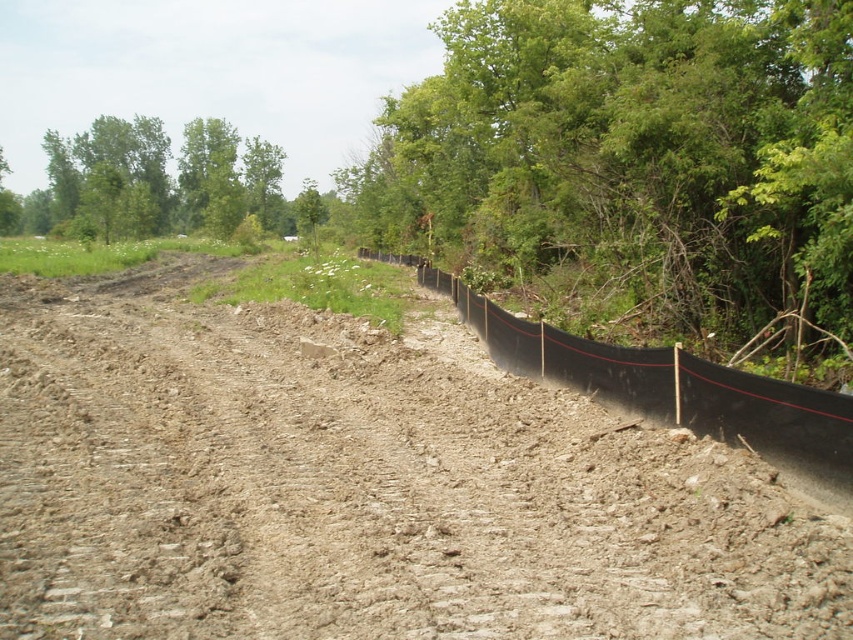
Question: Where is green leafy tree at right located in relation to green leafy tree at upper left in the image?

Choices:
 (A) left
 (B) right

Answer: (B)

Question: Does black plastic fence at right appear on the right side of green leafy tree at upper left?

Choices:
 (A) yes
 (B) no

Answer: (A)

Question: Among these points, which one is farthest from the camera?

Choices:
 (A) (817, 401)
 (B) (199, 205)

Answer: (B)

Question: Can you confirm if brown soil at center is bigger than green leafy tree at right?

Choices:
 (A) yes
 (B) no

Answer: (B)

Question: Which point appears closest to the camera in this image?

Choices:
 (A) (695, 92)
 (B) (165, 232)
 (C) (462, 305)

Answer: (A)

Question: Among these points, which one is farthest from the camera?

Choices:
 (A) (257, 204)
 (B) (766, 236)
 (C) (776, 388)
 (D) (225, 420)

Answer: (A)